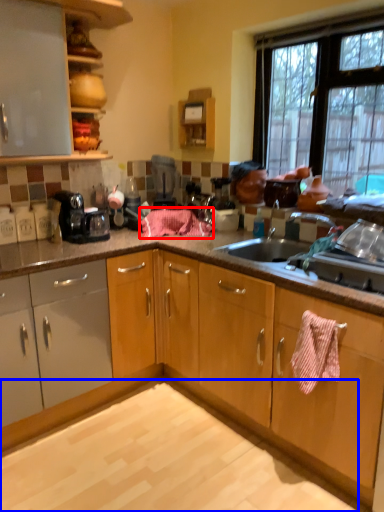
Question: Which point is further to the camera, blanket (highlighted by a red box) or granite (highlighted by a blue box)?

Choices:
 (A) blanket
 (B) granite

Answer: (A)